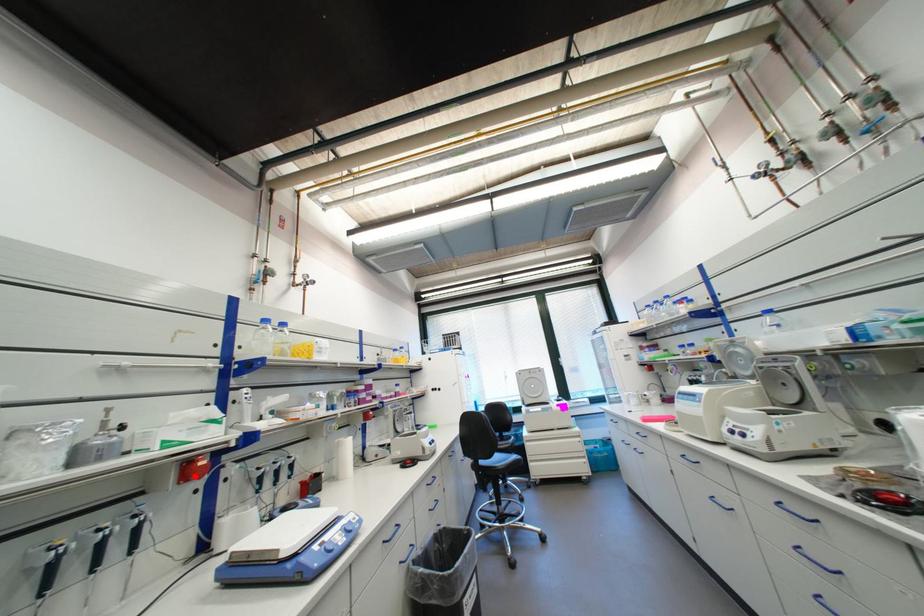
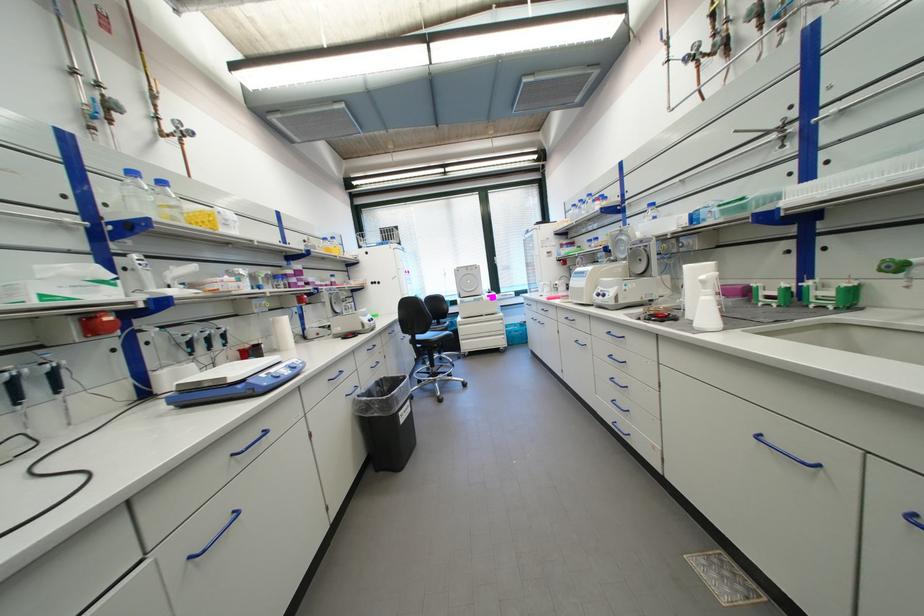
In the second image, find the point that corresponds to the highlighted location in the first image.

(101, 331)